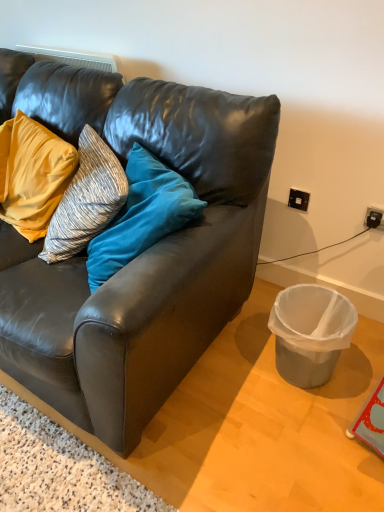
Question: Is black plastic power outlet at upper right, which is the second power outlet from front to back, a part of metallic gray trash can at lower right?

Choices:
 (A) no
 (B) yes

Answer: (A)

Question: Is metallic gray trash can at lower right turned away from black plastic power outlet at upper right, which is the second power outlet from front to back?

Choices:
 (A) yes
 (B) no

Answer: (B)

Question: Considering the relative positions of metallic gray trash can at lower right and black plastic power outlet at upper right, arranged as the first power outlet when viewed from the back, in the image provided, is metallic gray trash can at lower right behind black plastic power outlet at upper right, arranged as the first power outlet when viewed from the back,?

Choices:
 (A) no
 (B) yes

Answer: (A)

Question: From the image's perspective, is metallic gray trash can at lower right located beneath black plastic power outlet at upper right, which ranks as the first power outlet in left-to-right order?

Choices:
 (A) yes
 (B) no

Answer: (A)

Question: Considering the relative positions of metallic gray trash can at lower right and black plastic power outlet at upper right, the second power outlet positioned from the bottom, in the image provided, is metallic gray trash can at lower right to the right of black plastic power outlet at upper right, the second power outlet positioned from the bottom, from the viewer's perspective?

Choices:
 (A) yes
 (B) no

Answer: (B)

Question: Looking at their shapes, would you say black plastic power outlet at upper right, the 1th power outlet positioned from the right, is wider or thinner than metallic gray trash can at lower right?

Choices:
 (A) thin
 (B) wide

Answer: (A)

Question: Looking at the image, does black plastic power outlet at upper right, the 1th power outlet from the bottom, seem bigger or smaller compared to metallic gray trash can at lower right?

Choices:
 (A) small
 (B) big

Answer: (A)

Question: Is black plastic power outlet at upper right, the 2th power outlet viewed from the left, taller or shorter than metallic gray trash can at lower right?

Choices:
 (A) tall
 (B) short

Answer: (B)

Question: From the image's perspective, relative to metallic gray trash can at lower right, is black plastic power outlet at upper right, the 2th power outlet viewed from the left, above or below?

Choices:
 (A) below
 (B) above

Answer: (B)

Question: From the image's perspective, is metallic gray trash can at lower right positioned above or below matte yellow pillow at upper left?

Choices:
 (A) below
 (B) above

Answer: (A)

Question: Is point (321, 362) positioned closer to the camera than point (14, 180)?

Choices:
 (A) farther
 (B) closer

Answer: (B)

Question: Based on their positions, is metallic gray trash can at lower right located to the left or right of matte yellow pillow at upper left?

Choices:
 (A) right
 (B) left

Answer: (A)

Question: Considering the positions of metallic gray trash can at lower right and matte yellow pillow at upper left in the image, is metallic gray trash can at lower right taller or shorter than matte yellow pillow at upper left?

Choices:
 (A) short
 (B) tall

Answer: (A)

Question: Based on their sizes in the image, would you say black plastic power outlet at upper right, which is the second power outlet from front to back, is bigger or smaller than metallic gray trash can at lower right?

Choices:
 (A) small
 (B) big

Answer: (A)

Question: Is black plastic power outlet at upper right, the second power outlet positioned from the bottom, to the left or to the right of metallic gray trash can at lower right in the image?

Choices:
 (A) right
 (B) left

Answer: (A)